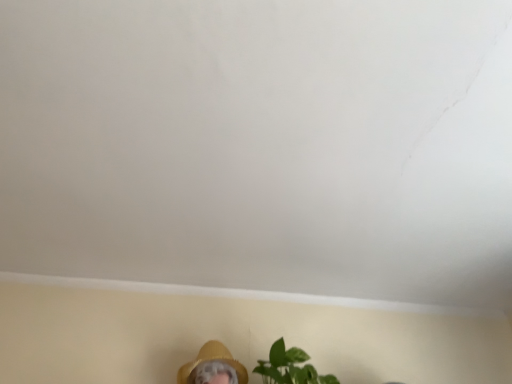
Question: In the image, is green matte plant at lower center positioned in front of or behind yellow straw hat at lower center?

Choices:
 (A) front
 (B) behind

Answer: (A)

Question: Is point [306, 357] positioned closer to the camera than point [189, 372]?

Choices:
 (A) closer
 (B) farther

Answer: (B)

Question: From a real-world perspective, is green matte plant at lower center physically located above or below yellow straw hat at lower center?

Choices:
 (A) above
 (B) below

Answer: (B)

Question: From a real-world perspective, is yellow straw hat at lower center positioned above or below green matte plant at lower center?

Choices:
 (A) below
 (B) above

Answer: (B)

Question: Considering the positions of point (206, 344) and point (273, 369), is point (206, 344) closer or farther from the camera than point (273, 369)?

Choices:
 (A) closer
 (B) farther

Answer: (B)

Question: From the image's perspective, is yellow straw hat at lower center located above or below green matte plant at lower center?

Choices:
 (A) below
 (B) above

Answer: (A)

Question: Relative to green matte plant at lower center, is yellow straw hat at lower center in front or behind?

Choices:
 (A) front
 (B) behind

Answer: (B)